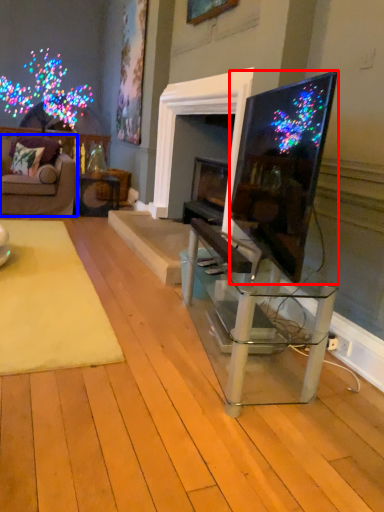
Question: Which object appears closest to the camera in this image, television (highlighted by a red box) or studio couch (highlighted by a blue box)?

Choices:
 (A) television
 (B) studio couch

Answer: (A)